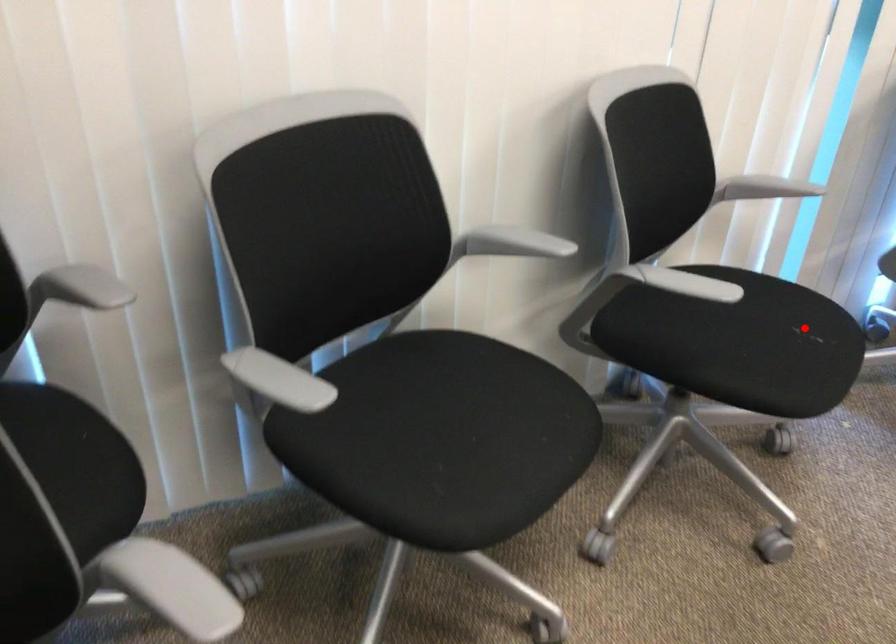
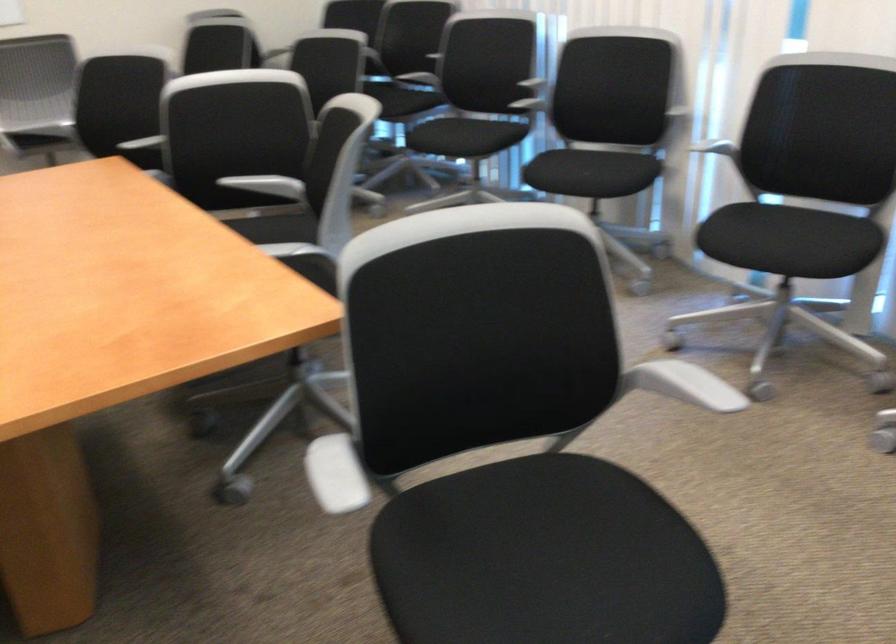
In the second image, find the point that corresponds to the highlighted location in the first image.

(587, 174)